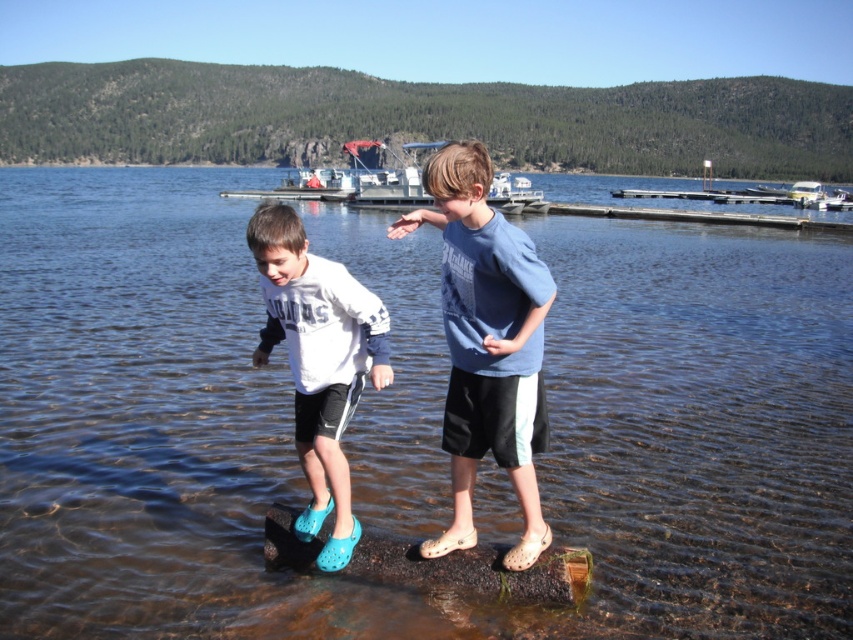
Is clear water at center positioned in front of brown rubber log at lower center?

No, clear water at center is further to the viewer.

Consider the image. Which is above, clear water at center or brown rubber log at lower center?

clear water at center is above.

Measure the distance between point (247,605) and camera.

Point (247,605) and camera are 5.28 meters apart from each other.

You are a GUI agent. You are given a task and a screenshot of the screen. Output one action in this format:
    pyautogui.click(x=<x>, y=<y>)
    Task: Click on the clear water at center
    Image resolution: width=853 pixels, height=640 pixels.
    Given the screenshot: What is the action you would take?
    pyautogui.click(x=291, y=426)

Does blue cotton shirt at center lie in front of white matte sneakers at center?

Yes, blue cotton shirt at center is closer to the viewer.

Between blue cotton shirt at center and white matte sneakers at center, which one appears on the left side from the viewer's perspective?

From the viewer's perspective, white matte sneakers at center appears more on the left side.

Between point (424, 172) and point (316, 371), which one is positioned in front?

Point (424, 172)

You are a GUI agent. You are given a task and a screenshot of the screen. Output one action in this format:
    pyautogui.click(x=<x>, y=<y>)
    Task: Click on the blue cotton shirt at center
    This screenshot has height=640, width=853.
    Given the screenshot: What is the action you would take?
    pyautogui.click(x=486, y=342)

Is clear water at center bigger than blue cotton shirt at center?

Correct, clear water at center is larger in size than blue cotton shirt at center.

Looking at this image, who is more distant from viewer, (15, 371) or (540, 424)?

The point (15, 371) is more distant.

Where is `clear water at center`? clear water at center is located at coordinates (291, 426).

The width and height of the screenshot is (853, 640). I want to click on clear water at center, so click(291, 426).